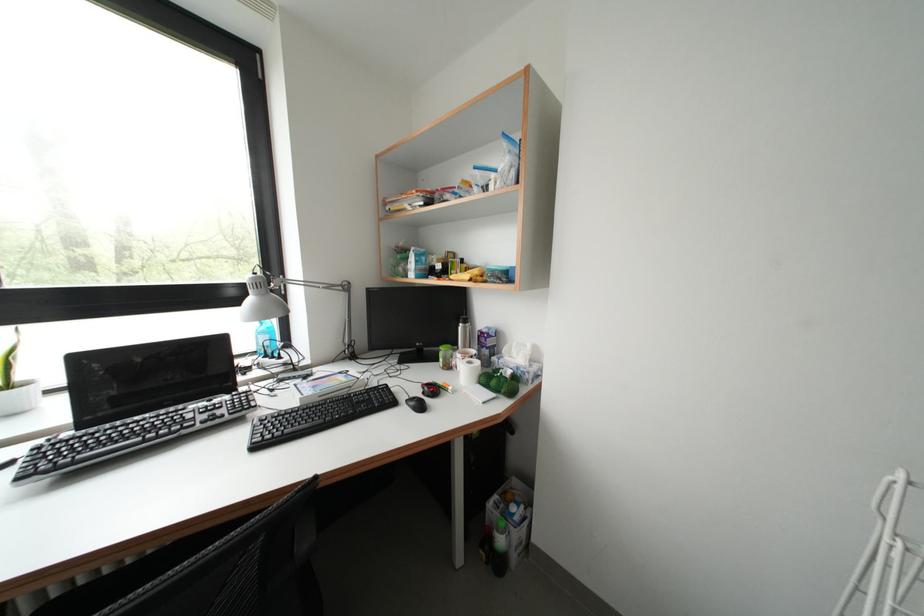
The width and height of the screenshot is (924, 616). I want to click on white mug handle, so click(468, 371).